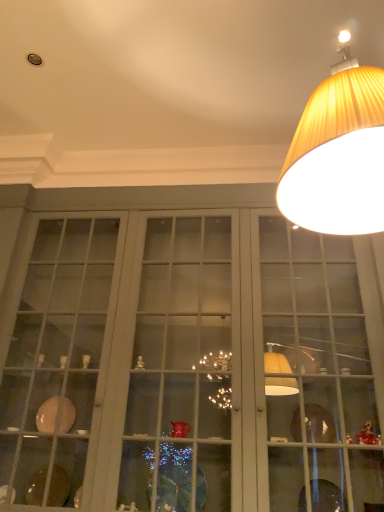
In order to face matte glass cabinet at center, should I rotate leftwards or rightwards?

Turn left approximately 0.911 degrees to face it.

Locate an element on the screen. matte glass cabinet at center is located at coordinates (186, 355).

What do you see at coordinates (186, 355) in the screenshot?
I see `matte glass cabinet at center` at bounding box center [186, 355].

You are a GUI agent. You are given a task and a screenshot of the screen. Output one action in this format:
    pyautogui.click(x=<x>, y=<y>)
    Task: Click on the matte glass cabinet at center
    
    Given the screenshot: What is the action you would take?
    pyautogui.click(x=186, y=355)